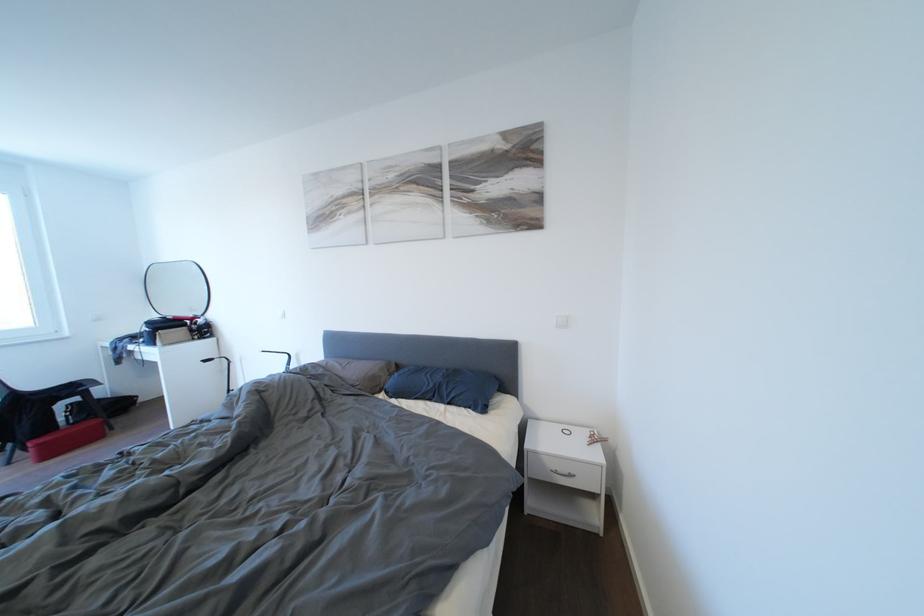
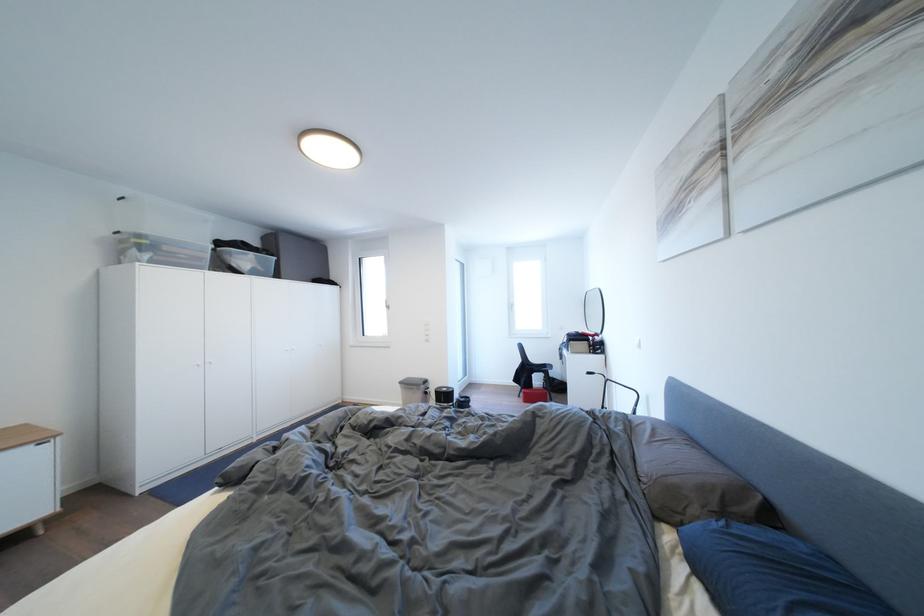
Find the pixel in the second image that matches the point at 46,450 in the first image.

(532, 398)